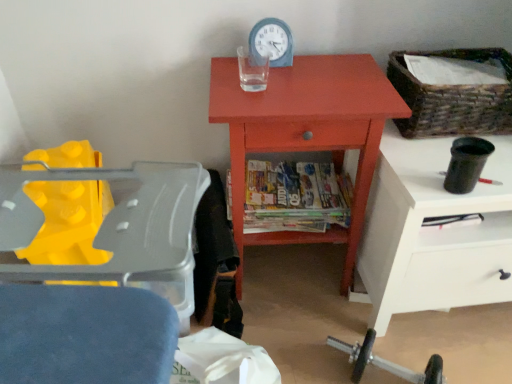
Locate an element on the screen. free space in front of matte orange cabinet at center is located at coordinates (310, 330).